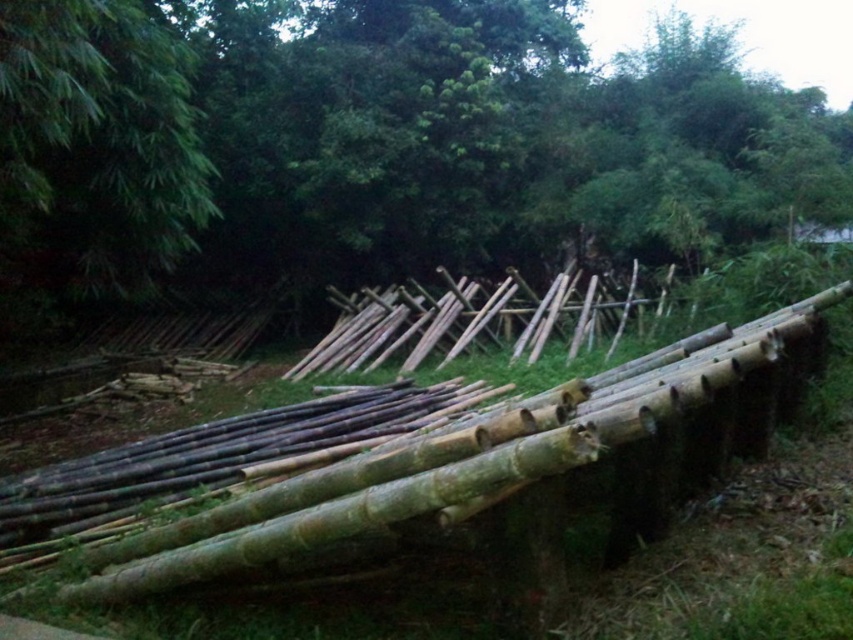
Question: Can you confirm if natural bamboo at center is thinner than green bamboo at upper left?

Choices:
 (A) no
 (B) yes

Answer: (A)

Question: Considering the real-world distances, which object is closest to the green bamboo at upper left?

Choices:
 (A) natural bamboo at center
 (B) green bamboo logs at center

Answer: (A)

Question: In this image, where is natural bamboo at center located relative to green bamboo at upper left?

Choices:
 (A) above
 (B) below

Answer: (A)

Question: Which point is farther to the camera?

Choices:
 (A) green bamboo logs at center
 (B) green bamboo at upper left

Answer: (B)

Question: Is natural bamboo at center below green bamboo logs at center?

Choices:
 (A) yes
 (B) no

Answer: (B)

Question: Among these points, which one is farthest from the camera?

Choices:
 (A) (227, 556)
 (B) (78, 86)

Answer: (B)